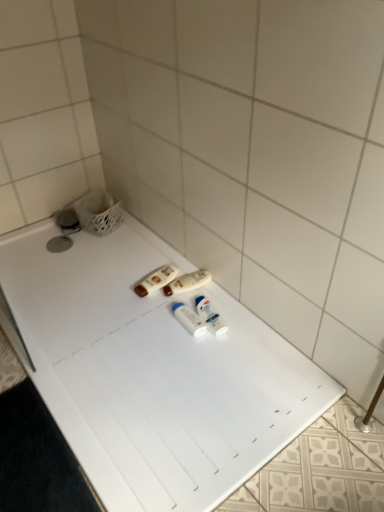
Find the location of a particular element. free space behind white plastic bottles at center, the 3th toiletry when ordered from left to right is located at coordinates (185, 300).